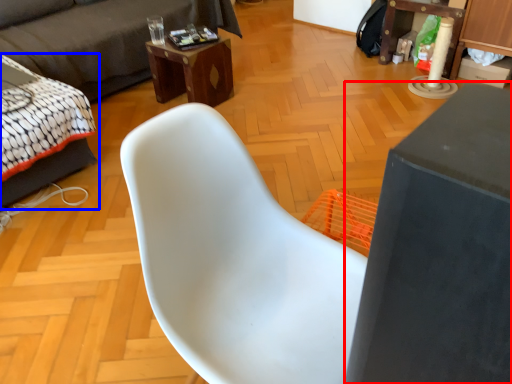
Question: Among these objects, which one is farthest to the camera, table (highlighted by a red box) or bed (highlighted by a blue box)?

Choices:
 (A) table
 (B) bed

Answer: (B)